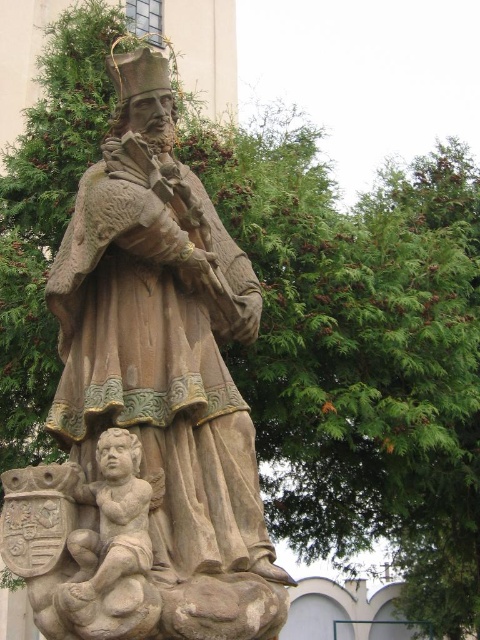
Question: Considering the relative positions of stone statue at center and smooth stone cherub at lower left in the image provided, where is stone statue at center located with respect to smooth stone cherub at lower left?

Choices:
 (A) above
 (B) below

Answer: (A)

Question: Is stone statue at center smaller than smooth stone cherub at lower left?

Choices:
 (A) yes
 (B) no

Answer: (B)

Question: From the image, what is the correct spatial relationship of stone statue at center in relation to smooth stone cherub at lower left?

Choices:
 (A) below
 (B) above

Answer: (B)

Question: Which point is farther from the camera taking this photo?

Choices:
 (A) (245, 292)
 (B) (134, 563)

Answer: (A)